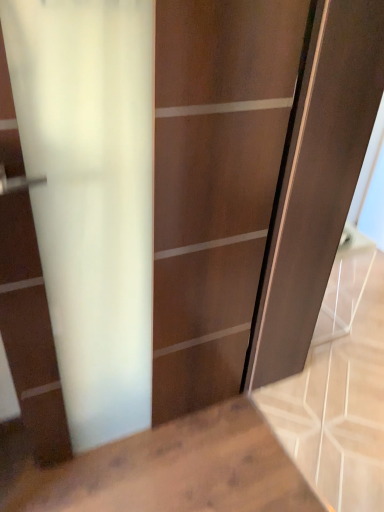
What is the approximate width of white glossy countertop at lower right?

white glossy countertop at lower right is 1.02 meters wide.

Describe the element at coordinates (173, 470) in the screenshot. I see `white glossy countertop at lower right` at that location.

Where is `white glossy countertop at lower right`? Image resolution: width=384 pixels, height=512 pixels. white glossy countertop at lower right is located at coordinates (173, 470).

In order to click on white glossy countertop at lower right in this screenshot , I will do `click(173, 470)`.